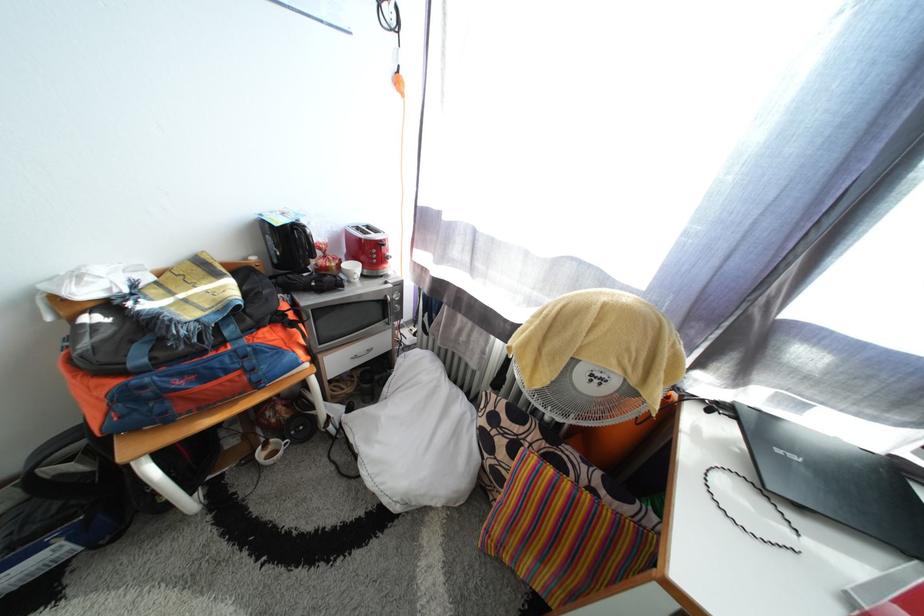
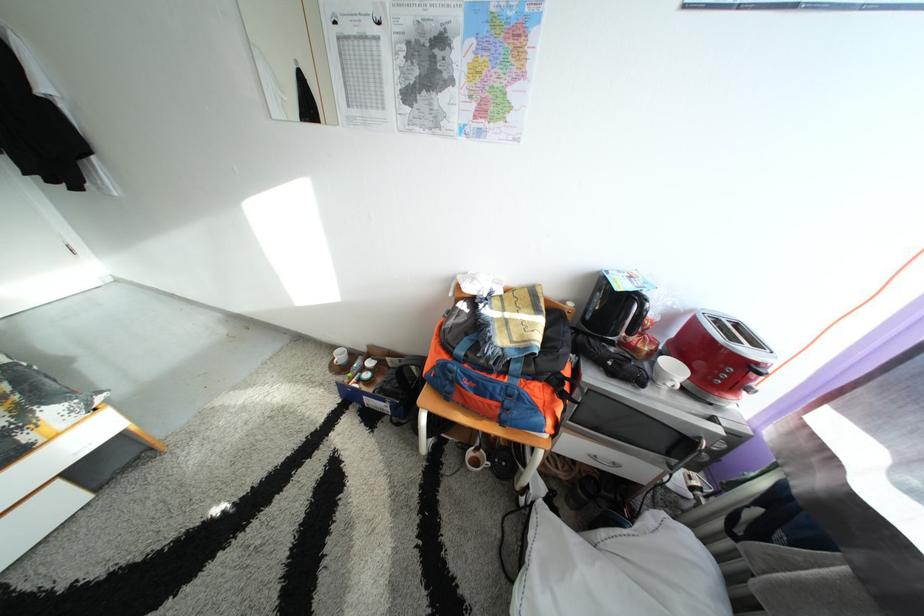
The point at (286, 227) is marked in the first image. Where is the corresponding point in the second image?

(630, 292)